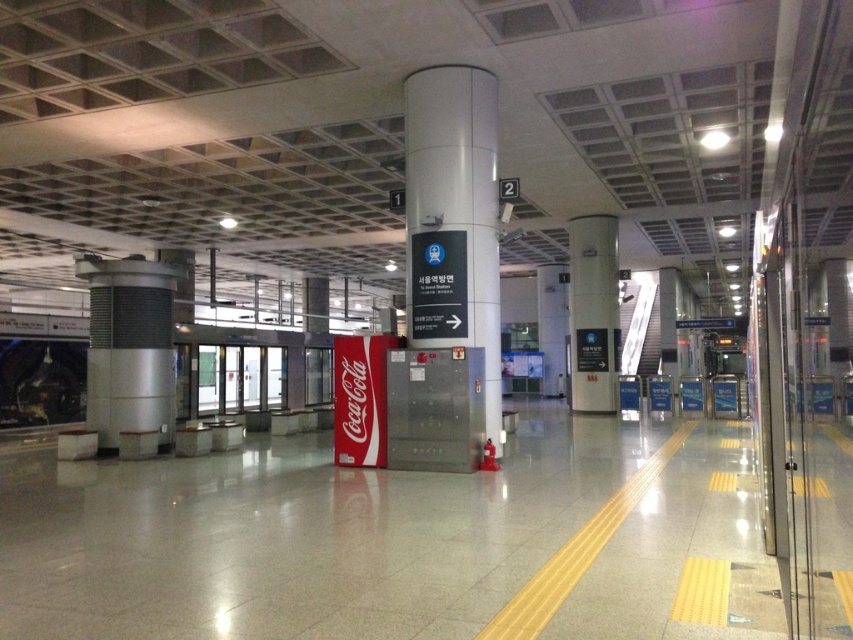
Does satin silver signpost at center lie in front of white glossy pillar at center?

Yes, satin silver signpost at center is closer to the viewer.

Is satin silver signpost at center to the left of white glossy pillar at center from the viewer's perspective?

Indeed, satin silver signpost at center is positioned on the left side of white glossy pillar at center.

Where is `satin silver signpost at center`? The image size is (853, 640). satin silver signpost at center is located at coordinates (460, 189).

Is point (460, 132) closer to camera compared to point (107, 442)?

Yes.

Is point (485, 145) farther from camera compared to point (137, 305)?

No, it is in front of (137, 305).

What are the coordinates of `satin silver signpost at center` in the screenshot? It's located at (460, 189).

Does silver metallic pillar at left have a greater width compared to white glossy pillar at center?

Yes.

Which is more to the right, silver metallic pillar at left or white glossy pillar at center?

From the viewer's perspective, white glossy pillar at center appears more on the right side.

Identify the location of silver metallic pillar at left. (129, 348).